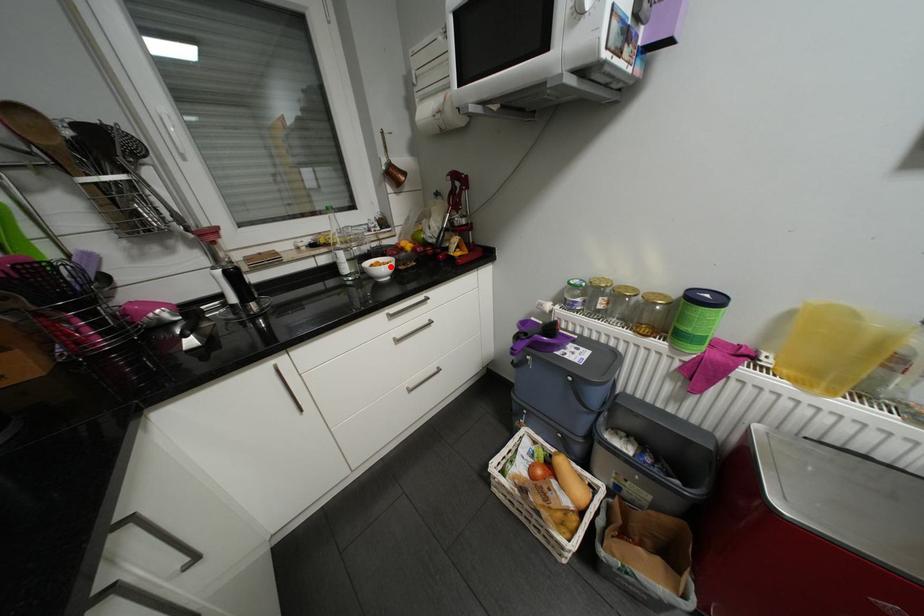
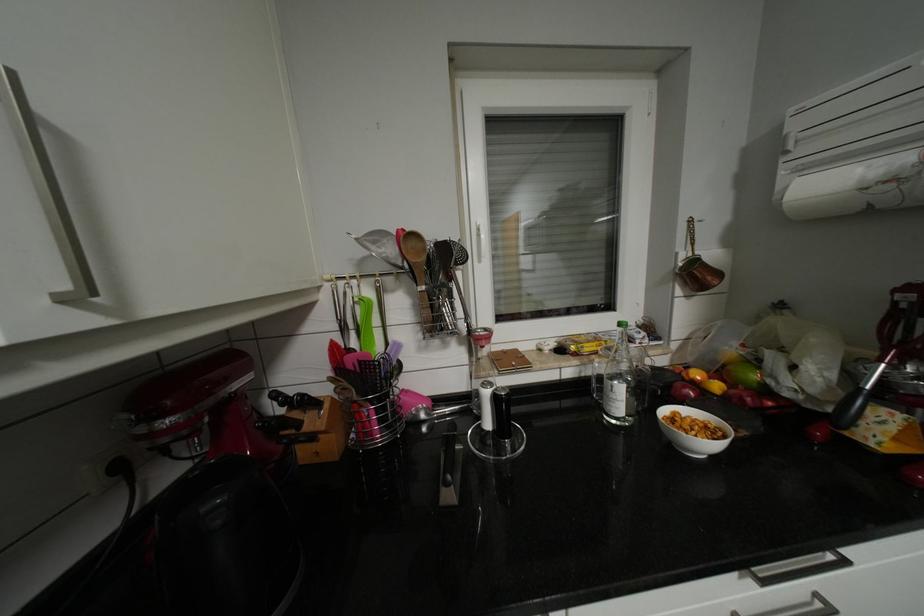
Where in the second image is the point corresponding to the highlighted location from the first image?

(703, 430)